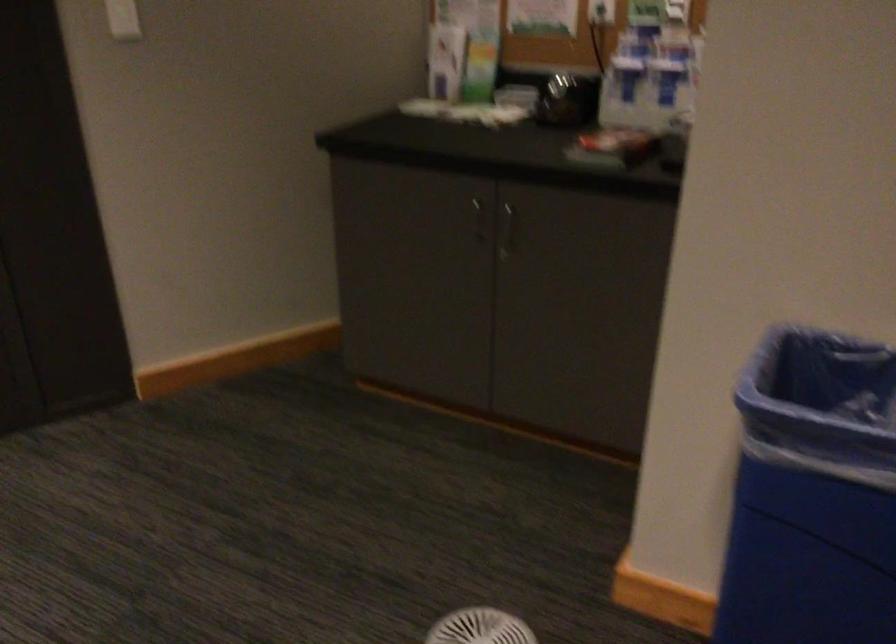
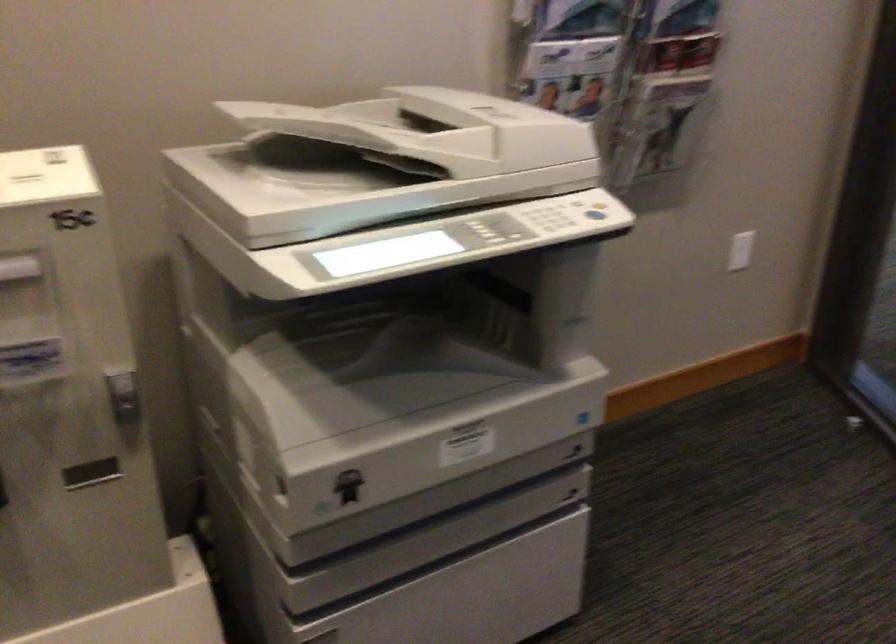
First-person continuous shooting, in which direction is the camera rotating?

The camera's rotation is toward left-down.